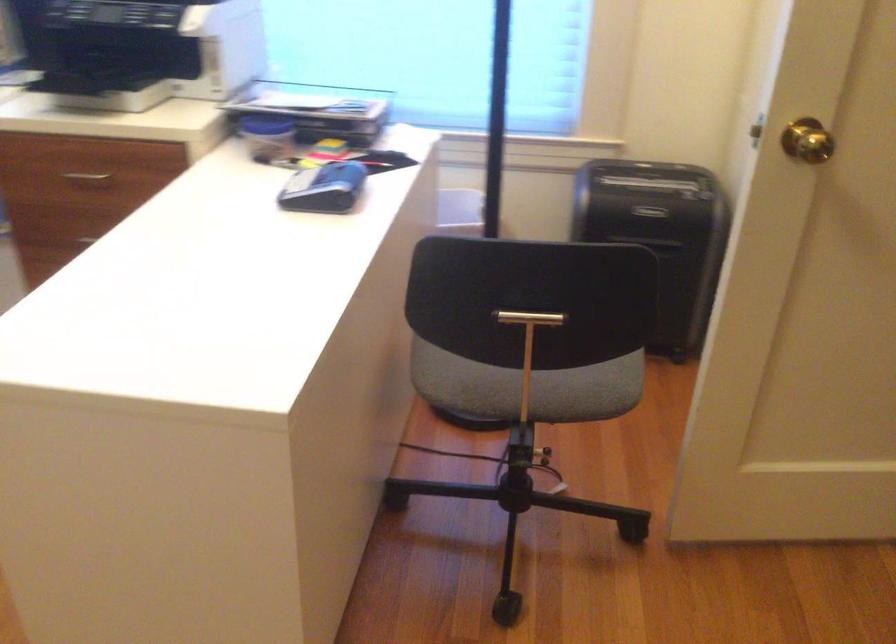
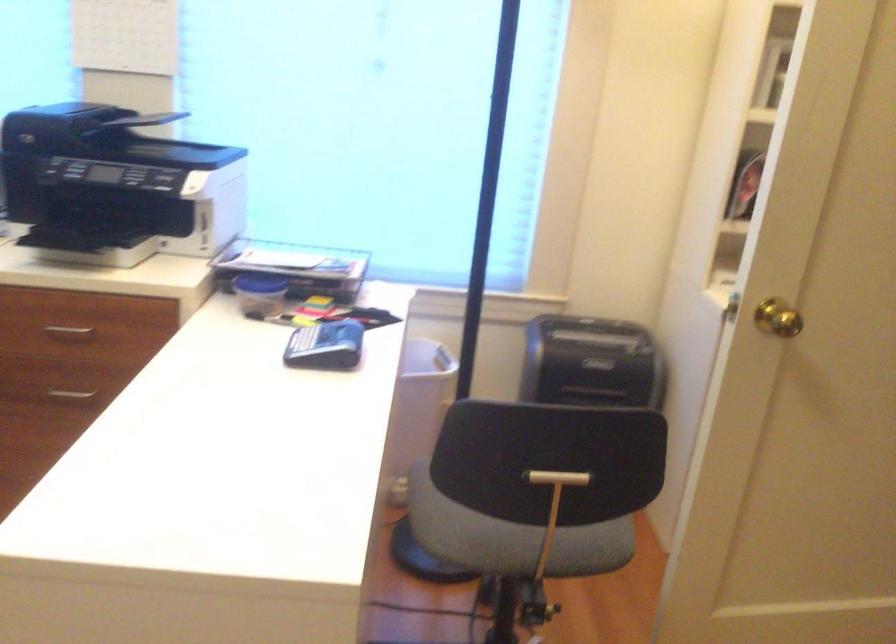
Question: The images are taken continuously from a first-person perspective. In which direction is your viewpoint rotating?

Choices:
 (A) Left
 (B) Right
 (C) Up
 (D) Down

Answer: (C)